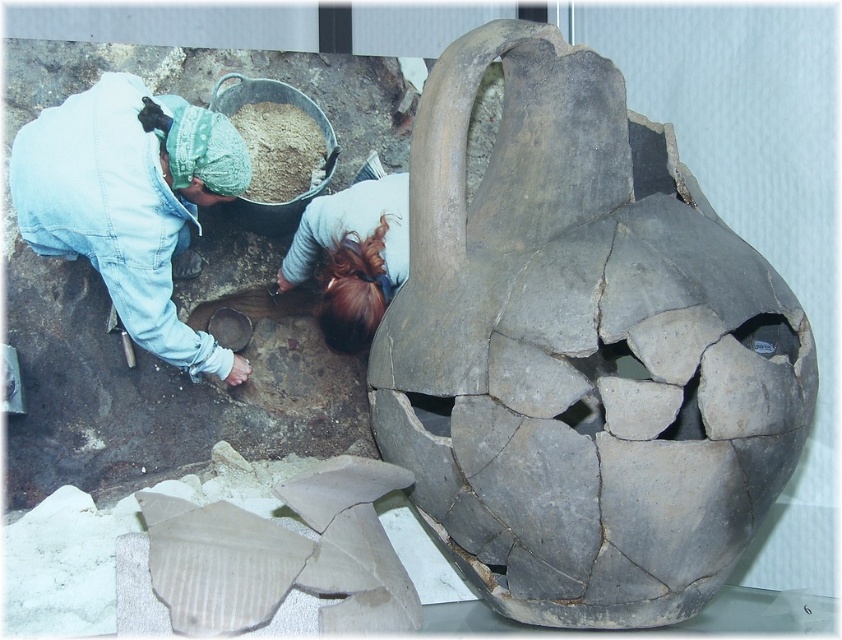
Question: Is gray cracked pottery at center above brown powder at center?

Choices:
 (A) yes
 (B) no

Answer: (B)

Question: Which of the following is the farthest from the observer?

Choices:
 (A) denim jacket at lower left
 (B) brown powder at center

Answer: (B)

Question: Is gray cracked pottery at center positioned behind denim jacket at lower left?

Choices:
 (A) yes
 (B) no

Answer: (B)

Question: In this image, where is gray cracked pottery at center located relative to denim jacket at lower left?

Choices:
 (A) right
 (B) left

Answer: (A)

Question: Which point appears closest to the camera in this image?

Choices:
 (A) (393, 195)
 (B) (659, 593)
 (C) (196, 131)

Answer: (B)

Question: Which object appears closest to the camera in this image?

Choices:
 (A) denim jacket at lower left
 (B) gray cracked pottery at center
 (C) brown hair at lower center
 (D) brown powder at center

Answer: (B)